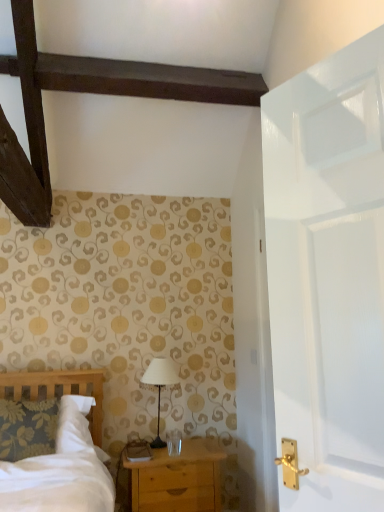
Image resolution: width=384 pixels, height=512 pixels. In order to click on vacant point to the right of white fabric lampshade at center in this screenshot , I will do `click(204, 446)`.